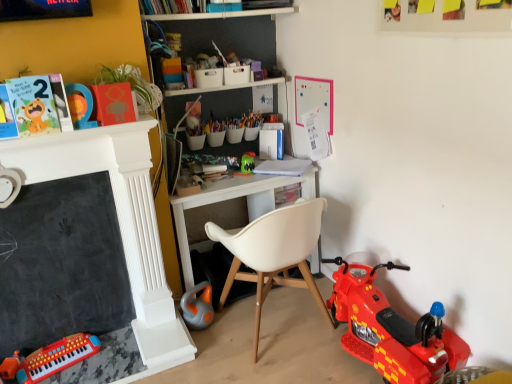
At what (x,y) coordinates should I click in order to perform the action: click on spots to the right of plastic keyboard at lower left, the 5th toy from the right. Please return your answer as a coordinate pair (x, y). The height and width of the screenshot is (384, 512). Looking at the image, I should click on (117, 360).